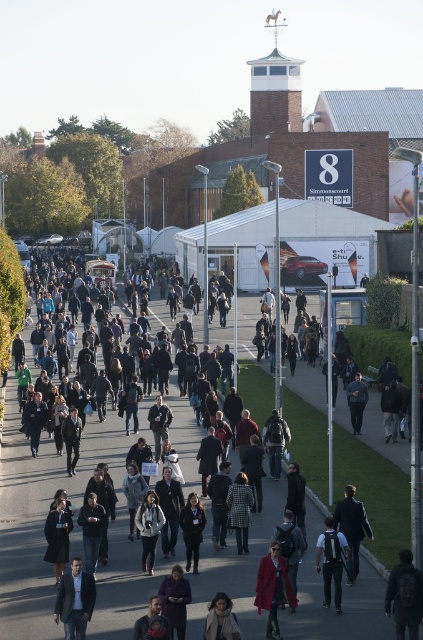
You are at the event and want to locate your friend who is wearing a light brown leather jacket at lower center. According to the coordinates provided, where exactly should you look?

You should look at point (220,620) to find the light brown leather jacket at lower center.

You are at the Simmons court event and want to take a photo of both the point at coordinates (346, 461) and the point at coordinates (324, 532) in the same frame. Which point should you stand closer to in order to capture both in your camera view?

To capture both points in the same frame, you should stand closer to point (324, 532) because point (346, 461) is behind it. By positioning yourself near the front point, you can ensure both are visible without obstruction.

From the picture: You are a person who is 5 feet 6 inches tall. You are standing in the middle of the crowd at the event and see the dark gray backpack at center and the dark gray coat at center. If you want to pick up both items, which one would you reach for first without moving your feet?

Since the dark gray backpack at center and dark gray coat at center are 29.74 inches apart, you would need to decide based on which is closer to your reach. However, the description does not specify which is closer to you. Therefore, you cannot determine which to reach for first without additional information.